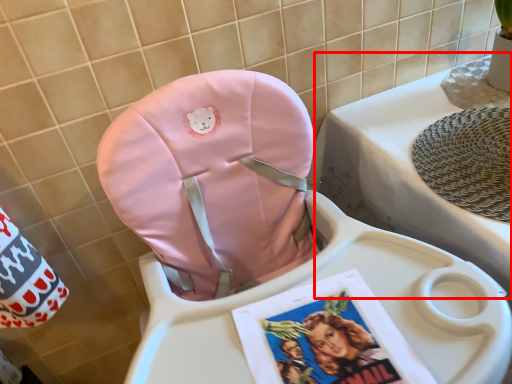
Question: From the image's perspective, what is the correct spatial relationship of changing table (annotated by the red box) in relation to baby carriage?

Choices:
 (A) above
 (B) below

Answer: (A)